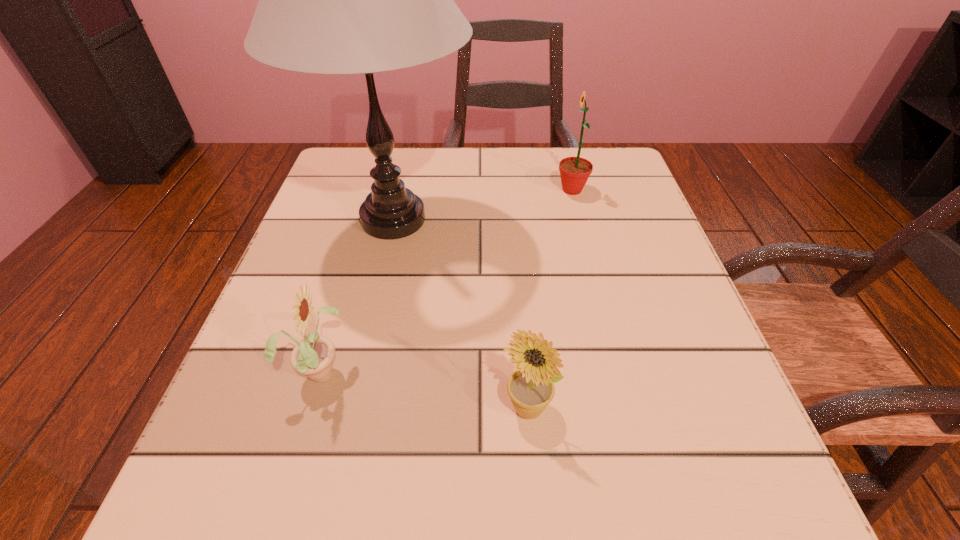
This screenshot has height=540, width=960. Identify the location of the tallest object. (331, 0).

Locate an element on the screen. The image size is (960, 540). the second tallest object is located at coordinates (574, 171).

This screenshot has height=540, width=960. What are the coordinates of `the farthest sunflower` in the screenshot? It's located at (574, 171).

Locate an element on the screen. The width and height of the screenshot is (960, 540). the leftmost sunflower is located at coordinates (313, 356).

Find the location of `the second object from right to left`. the second object from right to left is located at coordinates (531, 388).

The height and width of the screenshot is (540, 960). I want to click on blank space located on the front of the tallest object, so [x=351, y=408].

Find the location of `free spot located on the face of the rightmost sunflower`. free spot located on the face of the rightmost sunflower is located at coordinates (471, 190).

Identify the location of vacant space located on the face of the rightmost sunflower. (524, 190).

Identify the location of free spot located 0.150m on the face of the rightmost sunflower. (489, 190).

The image size is (960, 540). Find the location of `free location located on the front-facing side of the leftmost sunflower`. free location located on the front-facing side of the leftmost sunflower is located at coordinates (388, 370).